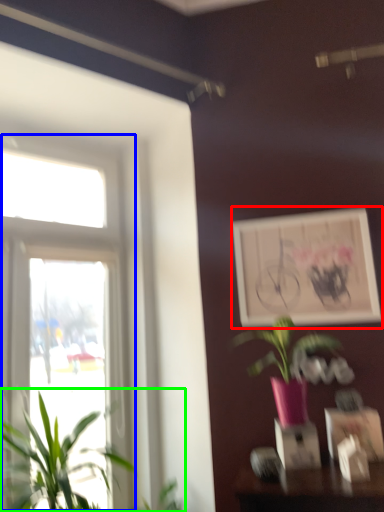
Question: Based on their relative distances, which object is farther from picture frame (highlighted by a red box)? Choose from window (highlighted by a blue box) and houseplant (highlighted by a green box).

Choices:
 (A) window
 (B) houseplant

Answer: (B)